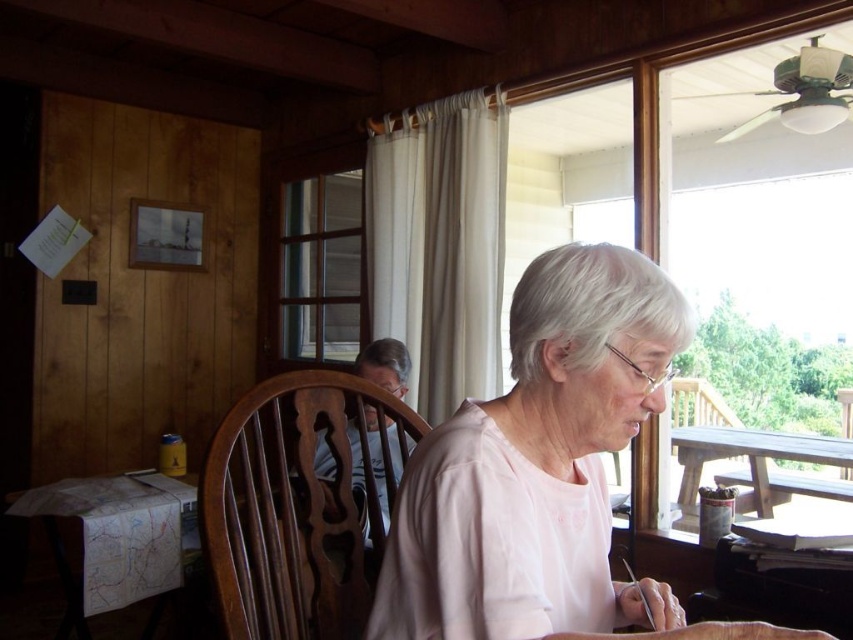
In the scene shown: Can you confirm if pink fabric at center is wider than white paper map at lower left?

In fact, pink fabric at center might be narrower than white paper map at lower left.

Between pink fabric at center and white paper map at lower left, which one is positioned higher?

Positioned higher is pink fabric at center.

Identify the location of pink fabric at center. This screenshot has height=640, width=853. (544, 472).

Which is behind, point (144, 477) or point (780, 445)?

Positioned behind is point (780, 445).

Who is higher up, white paper map at lower left or wooden picnic table at right?

wooden picnic table at right is higher up.

Is point (115, 554) positioned after point (790, 460)?

No, (115, 554) is in front of (790, 460).

What are the coordinates of `white paper map at lower left` in the screenshot? It's located at (117, 541).

Is point (665, 324) farther from camera compared to point (767, 454)?

That is False.

Does pink fabric at center appear on the right side of wooden picnic table at right?

Incorrect, pink fabric at center is not on the right side of wooden picnic table at right.

Which is in front, point (389, 545) or point (692, 476)?

Positioned in front is point (389, 545).

In order to click on pink fabric at center in this screenshot , I will do `click(544, 472)`.